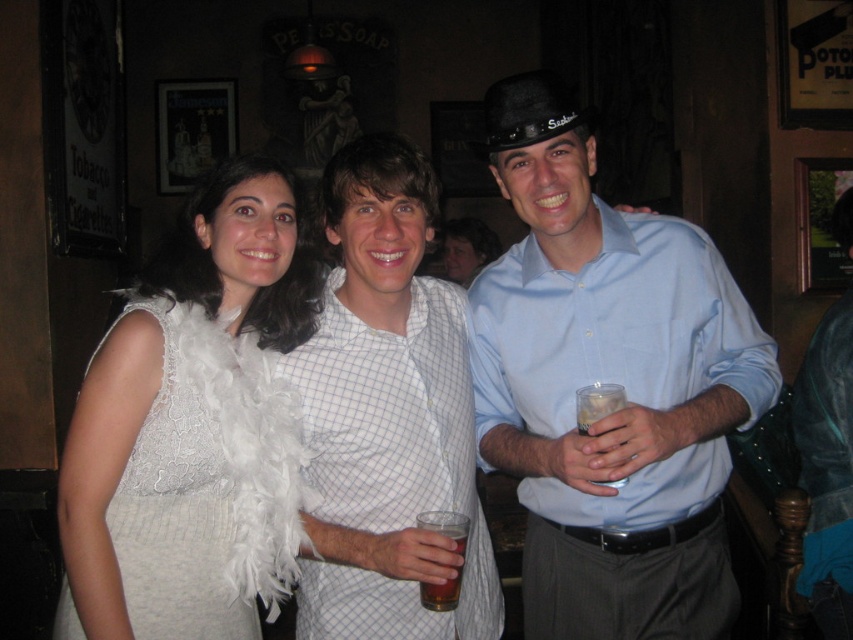
Question: Which point appears farthest from the camera in this image?

Choices:
 (A) (325, 529)
 (B) (602, 307)

Answer: (B)

Question: Which of the following is the closest to the observer?

Choices:
 (A) light blue shirt at center
 (B) translucent glass at center
 (C) white feather boa at left

Answer: (B)

Question: Does light blue shirt at center have a smaller size compared to brown translucent glass at center?

Choices:
 (A) no
 (B) yes

Answer: (A)

Question: Is white feather boa at left below translucent glass at center?

Choices:
 (A) no
 (B) yes

Answer: (A)

Question: Which point is closer to the camera taking this photo?

Choices:
 (A) [149, 602]
 (B) [614, 397]
 (C) [412, 477]
 (D) [631, 401]

Answer: (B)

Question: Does light blue shirt at center have a larger size compared to translucent glass at center?

Choices:
 (A) yes
 (B) no

Answer: (A)